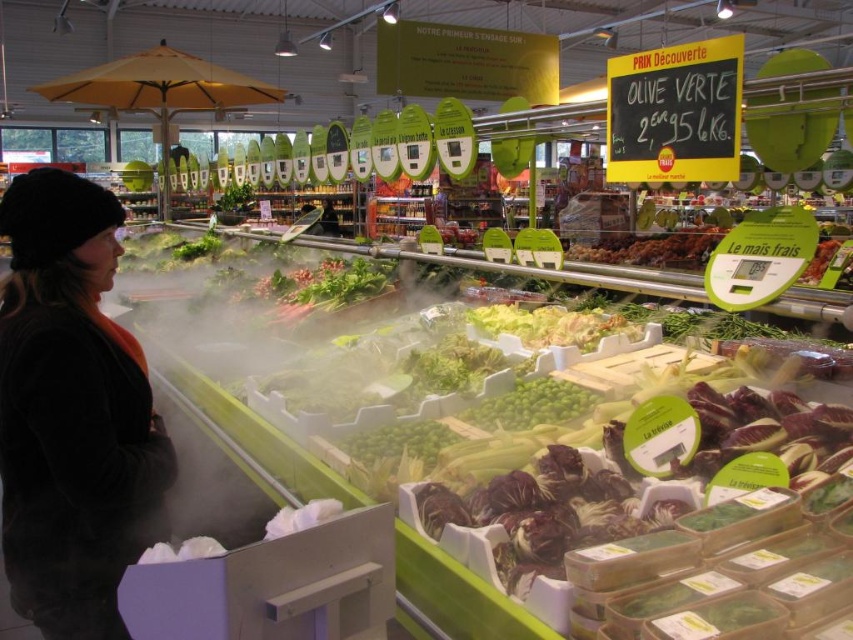
Can you confirm if black fuzzy hat at upper left is bigger than black chalkboard at upper right?

Yes.

Locate an element on the screen. This screenshot has width=853, height=640. black fuzzy hat at upper left is located at coordinates click(71, 412).